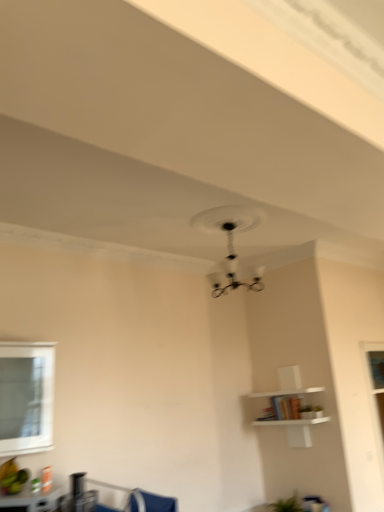
Question: Considering the positions of blue fabric swivel chair at lower center and matte black table at lower left in the image, is blue fabric swivel chair at lower center taller or shorter than matte black table at lower left?

Choices:
 (A) short
 (B) tall

Answer: (B)

Question: Is point (140, 495) positioned closer to the camera than point (51, 494)?

Choices:
 (A) farther
 (B) closer

Answer: (A)

Question: Which object is the farthest from the black matte fan at upper center?

Choices:
 (A) matte black table at lower left
 (B) clear glass window at lower left
 (C) white matte shelf at upper right
 (D) blue fabric swivel chair at lower center

Answer: (A)

Question: Which object is positioned farthest from the matte black table at lower left?

Choices:
 (A) white matte shelf at upper right
 (B) black matte fan at upper center
 (C) blue fabric swivel chair at lower center
 (D) clear glass window at lower left

Answer: (B)